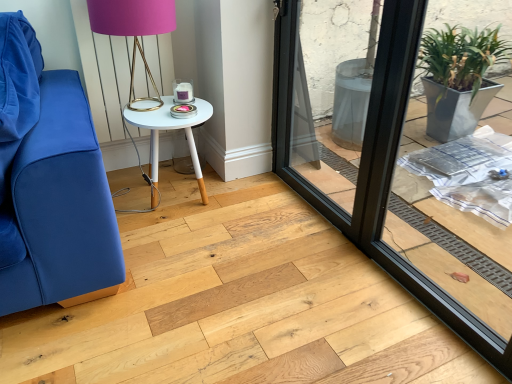
Question: From a real-world perspective, is matte gold table lamp at upper center positioned under white painted wood table at center based on gravity?

Choices:
 (A) yes
 (B) no

Answer: (B)

Question: Does matte gold table lamp at upper center have a lesser height compared to white painted wood table at center?

Choices:
 (A) no
 (B) yes

Answer: (A)

Question: From the image's perspective, is matte gold table lamp at upper center on white painted wood table at center?

Choices:
 (A) yes
 (B) no

Answer: (A)

Question: From the image's perspective, is matte gold table lamp at upper center beneath white painted wood table at center?

Choices:
 (A) yes
 (B) no

Answer: (B)

Question: Is white painted wood table at center at the back of matte gold table lamp at upper center?

Choices:
 (A) yes
 (B) no

Answer: (B)

Question: Considering the positions of white painted wood table at center and black glass window frame at center in the image, is white painted wood table at center wider or thinner than black glass window frame at center?

Choices:
 (A) thin
 (B) wide

Answer: (B)

Question: Considering their positions, is white painted wood table at center located in front of or behind black glass window frame at center?

Choices:
 (A) behind
 (B) front

Answer: (A)

Question: In terms of size, does white painted wood table at center appear bigger or smaller than black glass window frame at center?

Choices:
 (A) small
 (B) big

Answer: (A)

Question: Is white painted wood table at center situated inside black glass window frame at center or outside?

Choices:
 (A) outside
 (B) inside

Answer: (A)

Question: Is transparent glass screen door at center situated inside matte gold table lamp at upper center or outside?

Choices:
 (A) outside
 (B) inside

Answer: (A)

Question: Considering their positions, is transparent glass screen door at center located in front of or behind matte gold table lamp at upper center?

Choices:
 (A) behind
 (B) front

Answer: (B)

Question: Considering the positions of transparent glass screen door at center and matte gold table lamp at upper center in the image, is transparent glass screen door at center taller or shorter than matte gold table lamp at upper center?

Choices:
 (A) tall
 (B) short

Answer: (A)

Question: Visually, is transparent glass screen door at center positioned to the left or to the right of matte gold table lamp at upper center?

Choices:
 (A) left
 (B) right

Answer: (B)

Question: From the image's perspective, relative to black glass window frame at center, is matte gold table lamp at upper center above or below?

Choices:
 (A) below
 (B) above

Answer: (B)

Question: Is matte gold table lamp at upper center spatially inside black glass window frame at center, or outside of it?

Choices:
 (A) inside
 (B) outside

Answer: (B)